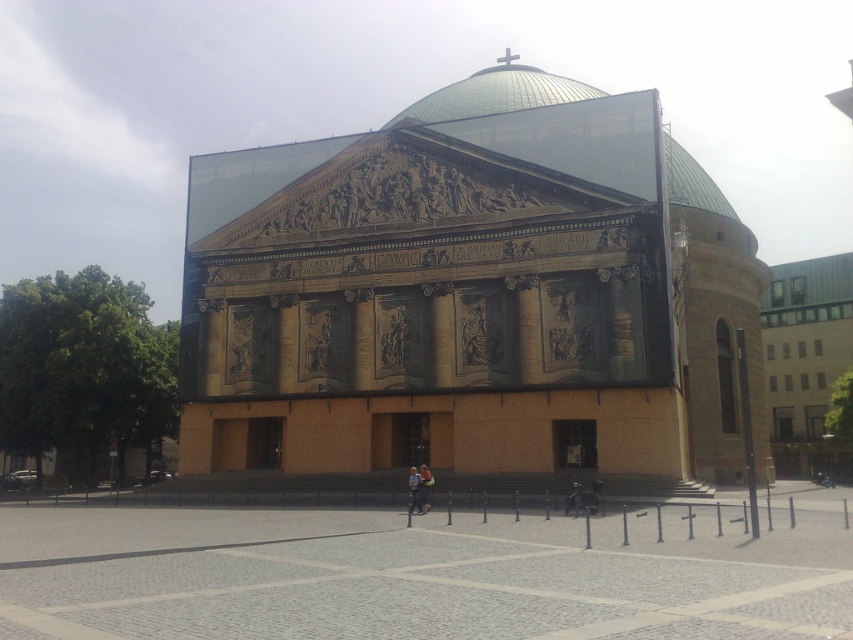
Question: Does light blue denim jacket at center lie behind light blue fabric jacket at center?

Choices:
 (A) yes
 (B) no

Answer: (B)

Question: Which point is closer to the camera?

Choices:
 (A) (432, 481)
 (B) (822, 406)

Answer: (A)

Question: Is green metal building at right smaller than light blue denim jacket at center?

Choices:
 (A) no
 (B) yes

Answer: (A)

Question: Can you confirm if light blue denim jacket at center is smaller than light blue fabric jacket at center?

Choices:
 (A) no
 (B) yes

Answer: (B)

Question: Estimate the real-world distances between objects in this image. Which object is farther from the light blue fabric jacket at center?

Choices:
 (A) gray cobblestone plaza at center
 (B) brown stone church at center
 (C) green metal building at right
 (D) light blue denim jacket at center

Answer: (C)

Question: Which object is positioned farthest from the light blue fabric jacket at center?

Choices:
 (A) green metal building at right
 (B) light blue denim jacket at center
 (C) brown stone church at center

Answer: (A)